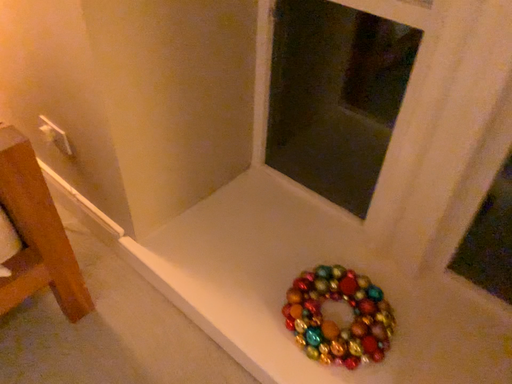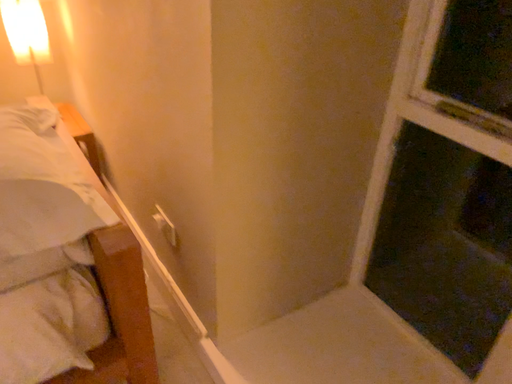
Question: Which way did the camera rotate in the video?

Choices:
 (A) rotated upward
 (B) rotated downward

Answer: (A)